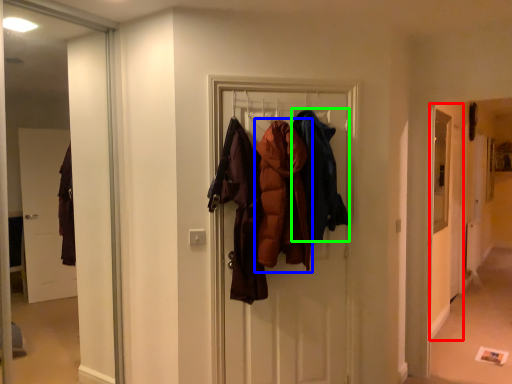
Question: Based on their relative distances, which object is nearer to screen door (highlighted by a red box)? Choose from garment (highlighted by a blue box) and garment (highlighted by a green box).

Choices:
 (A) garment
 (B) garment

Answer: (B)